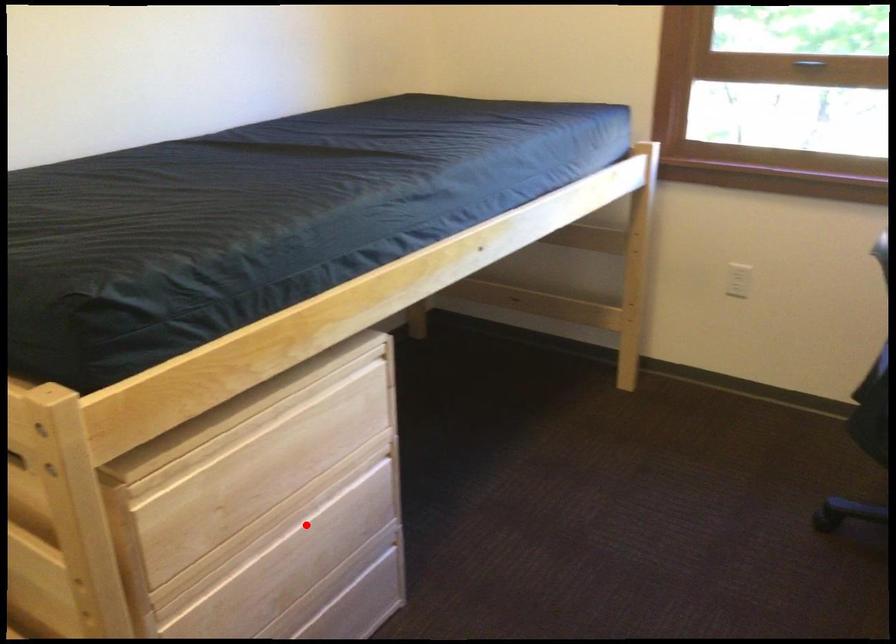
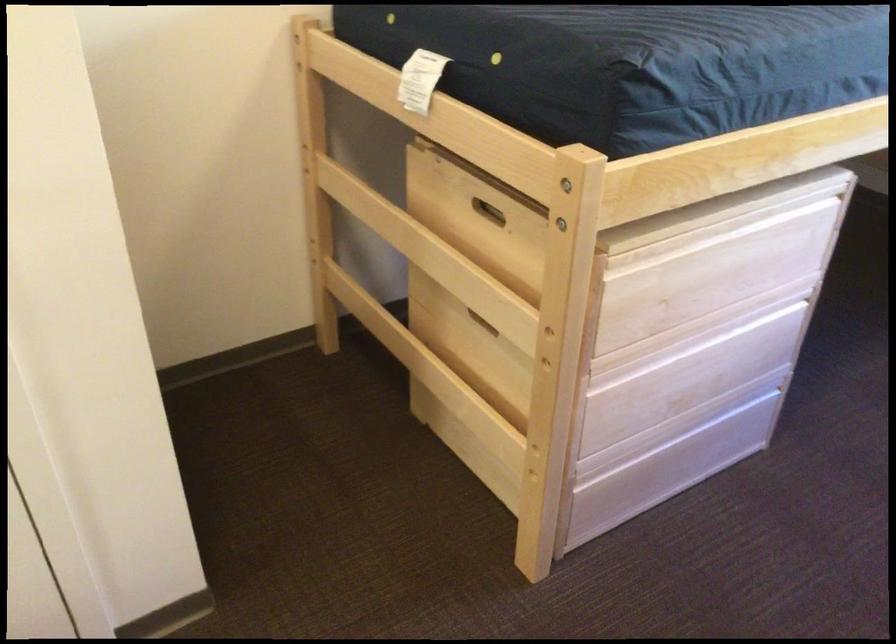
The point at the highlighted location is marked in the first image. Where is the corresponding point in the second image?

(718, 342)